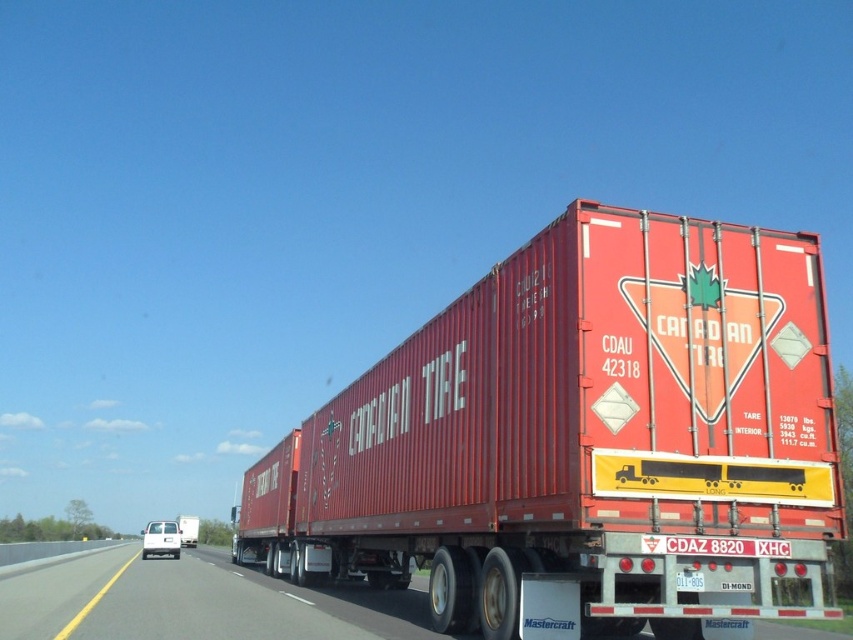
Question: Does metallic red trailer truck at center appear on the left side of matte red trailer at center?

Choices:
 (A) no
 (B) yes

Answer: (A)

Question: Which of these objects is positioned farthest from the metallic silver truck at center?

Choices:
 (A) metallic red trailer truck at center
 (B) matte red trailer at center

Answer: (B)

Question: Among these objects, which one is nearest to the camera?

Choices:
 (A) matte red trailer at center
 (B) metallic red trailer truck at center
 (C) metallic silver truck at center

Answer: (B)

Question: Does metallic silver truck at center have a smaller size compared to matte red trailer at center?

Choices:
 (A) no
 (B) yes

Answer: (B)

Question: Among these objects, which one is nearest to the camera?

Choices:
 (A) matte red trailer at center
 (B) metallic silver truck at center

Answer: (B)

Question: Can you confirm if metallic red trailer truck at center is smaller than metallic silver truck at center?

Choices:
 (A) no
 (B) yes

Answer: (B)